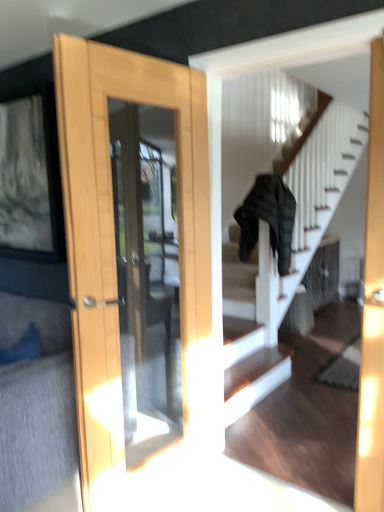
In order to click on textured gray couch at lower left in this screenshot , I will do `click(36, 404)`.

This screenshot has height=512, width=384. What do you see at coordinates (36, 404) in the screenshot?
I see `textured gray couch at lower left` at bounding box center [36, 404].

Image resolution: width=384 pixels, height=512 pixels. What do you see at coordinates (268, 219) in the screenshot?
I see `black fabric jacket at center` at bounding box center [268, 219].

Locate an element on the screen. black fabric jacket at center is located at coordinates (268, 219).

Where is `textured gray couch at lower left`? textured gray couch at lower left is located at coordinates (36, 404).

Is textured gray couch at lower left at the left side of black fabric jacket at center?

Yes, textured gray couch at lower left is to the left of black fabric jacket at center.

Is textured gray couch at lower left in front of or behind black fabric jacket at center in the image?

textured gray couch at lower left is positioned closer to the viewer than black fabric jacket at center.

Does point (50, 460) come farther from viewer compared to point (251, 212)?

No, it is in front of (251, 212).

From the image's perspective, which object appears higher, textured gray couch at lower left or black fabric jacket at center?

black fabric jacket at center is shown above in the image.

Looking at this image, from a real-world perspective, who is located higher, textured gray couch at lower left or black fabric jacket at center?

In real-world perspective, black fabric jacket at center is above.

Which object is thinner, textured gray couch at lower left or black fabric jacket at center?

textured gray couch at lower left is thinner.

Between textured gray couch at lower left and black fabric jacket at center, which one has more height?

Standing taller between the two is black fabric jacket at center.

Who is smaller, textured gray couch at lower left or black fabric jacket at center?

Smaller between the two is textured gray couch at lower left.

Is textured gray couch at lower left not within black fabric jacket at center?

Yes, textured gray couch at lower left is not within black fabric jacket at center.

Is textured gray couch at lower left beside black fabric jacket at center?

No.

Is textured gray couch at lower left facing towards black fabric jacket at center?

No, textured gray couch at lower left is not turned towards black fabric jacket at center.

I want to click on clothing behind the textured gray couch at lower left, so click(268, 219).

Which is more to the left, black fabric jacket at center or textured gray couch at lower left?

textured gray couch at lower left is more to the left.

Which object is further away from the camera, black fabric jacket at center or textured gray couch at lower left?

black fabric jacket at center.

Between point (293, 215) and point (4, 308), which one is positioned behind?

The point (293, 215) is more distant.

From the image's perspective, relative to textured gray couch at lower left, is black fabric jacket at center above or below?

Based on their image positions, black fabric jacket at center is located above textured gray couch at lower left.

From a real-world perspective, is black fabric jacket at center located beneath textured gray couch at lower left?

No, from a real-world perspective, black fabric jacket at center is not beneath textured gray couch at lower left.

Considering the relative sizes of black fabric jacket at center and textured gray couch at lower left in the image provided, is black fabric jacket at center wider than textured gray couch at lower left?

Correct, the width of black fabric jacket at center exceeds that of textured gray couch at lower left.

Between black fabric jacket at center and textured gray couch at lower left, which one has less height?

textured gray couch at lower left is shorter.

Between black fabric jacket at center and textured gray couch at lower left, which one has larger size?

black fabric jacket at center.

Is black fabric jacket at center not within textured gray couch at lower left?

That's correct, black fabric jacket at center is outside of textured gray couch at lower left.

In the scene shown: Can you see black fabric jacket at center touching textured gray couch at lower left?

No, black fabric jacket at center is not with textured gray couch at lower left.

Consider the image. Is black fabric jacket at center oriented towards textured gray couch at lower left?

No, black fabric jacket at center is not turned towards textured gray couch at lower left.

How many degrees apart are the facing directions of black fabric jacket at center and textured gray couch at lower left?

The angle between the facing direction of black fabric jacket at center and the facing direction of textured gray couch at lower left is 149 degrees.

I want to click on couch on the left of the black fabric jacket at center, so click(36, 404).

You are a GUI agent. You are given a task and a screenshot of the screen. Output one action in this format:
    pyautogui.click(x=<x>, y=<y>)
    Task: Click on the couch located on the left of black fabric jacket at center
    Image resolution: width=384 pixels, height=512 pixels.
    Given the screenshot: What is the action you would take?
    pos(36,404)

The width and height of the screenshot is (384, 512). What are the coordinates of `couch in front of the black fabric jacket at center` in the screenshot? It's located at (36, 404).